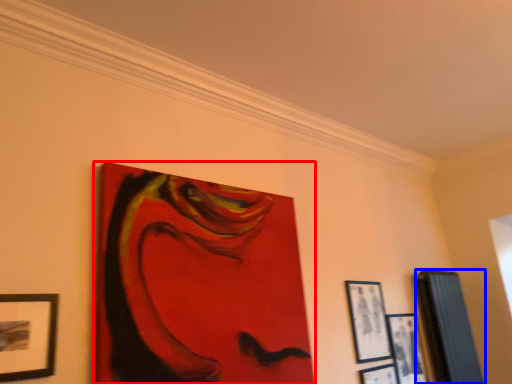
Question: Which point is closer to the camera, picture frame (highlighted by a red box) or picture frame (highlighted by a blue box)?

Choices:
 (A) picture frame
 (B) picture frame

Answer: (A)